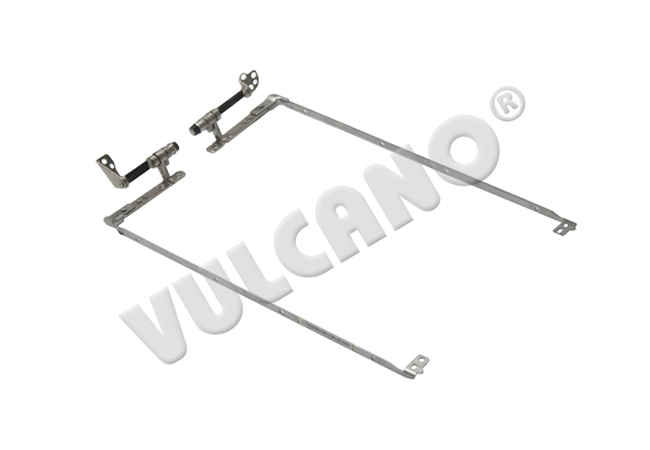
Identify the location of left upper knob. Image resolution: width=650 pixels, height=450 pixels. (106, 160).